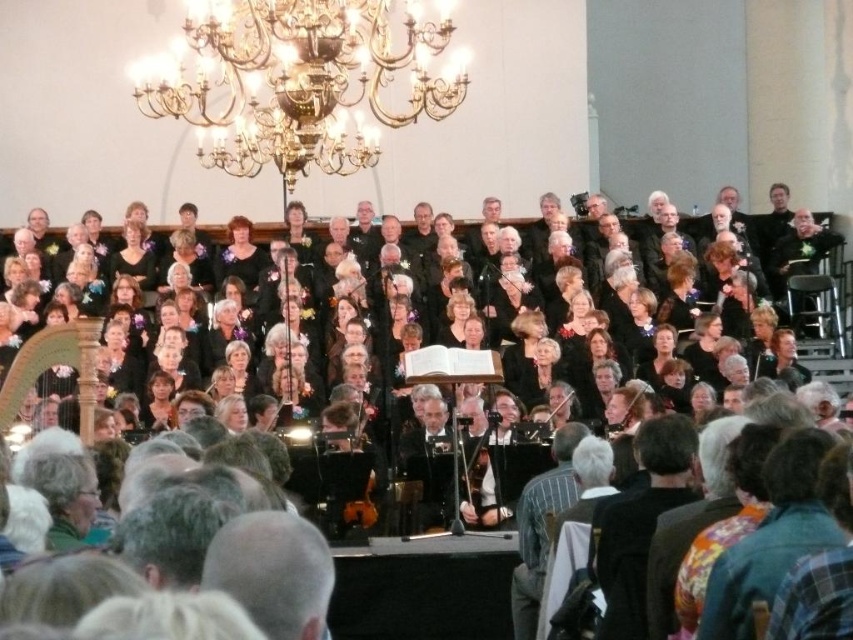
Question: Which is nearer to the striped fabric at center?

Choices:
 (A) dark brown suit at center
 (B) black leather jacket at upper center

Answer: (A)

Question: Considering the real-world distances, which object is farthest from the striped fabric at center?

Choices:
 (A) short hair at center
 (B) black leather jacket at upper center

Answer: (B)

Question: Can you confirm if dark brown suit at center is positioned above black leather jacket at upper center?

Choices:
 (A) yes
 (B) no

Answer: (B)

Question: Which object appears farthest from the camera in this image?

Choices:
 (A) short hair at center
 (B) dark brown suit at center
 (C) black leather jacket at upper center

Answer: (C)

Question: Is striped fabric at center closer to the viewer compared to black leather jacket at upper center?

Choices:
 (A) yes
 (B) no

Answer: (A)

Question: Is dark brown suit at center positioned in front of striped fabric at center?

Choices:
 (A) no
 (B) yes

Answer: (B)